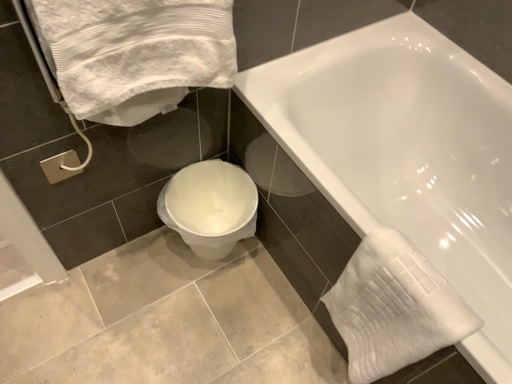
Image resolution: width=512 pixels, height=384 pixels. What do you see at coordinates (407, 154) in the screenshot?
I see `white glossy bathtub at center` at bounding box center [407, 154].

Image resolution: width=512 pixels, height=384 pixels. Find the location of `white textured towel at upper left, the 2th bath towel when ordered from bottom to top`. white textured towel at upper left, the 2th bath towel when ordered from bottom to top is located at coordinates click(x=136, y=53).

Image resolution: width=512 pixels, height=384 pixels. What do you see at coordinates (394, 307) in the screenshot?
I see `white textured towel at lower right, marked as the first bath towel in a right-to-left arrangement` at bounding box center [394, 307].

Locate an element on the screen. white textured towel at lower right, positioned as the 1th bath towel in bottom-to-top order is located at coordinates (394, 307).

Measure the distance between silver metallic towel bar at lower left and camera.

3.35 feet.

This screenshot has width=512, height=384. In order to click on white glossy bathtub at center in this screenshot , I will do `click(407, 154)`.

In the scene shown: Considering the positions of objects white textured towel at upper left, the second bath towel positioned from the right, and white plastic toilet at lower center in the image provided, who is more to the right, white textured towel at upper left, the second bath towel positioned from the right, or white plastic toilet at lower center?

From the viewer's perspective, white plastic toilet at lower center appears more on the right side.

From the image's perspective, is white textured towel at upper left, positioned as the 1th bath towel in left-to-right order, located above white plastic toilet at lower center?

Yes, from the image's perspective, white textured towel at upper left, positioned as the 1th bath towel in left-to-right order, is above white plastic toilet at lower center.

In the scene shown: Is white textured towel at upper left, positioned as the 1th bath towel in left-to-right order, oriented towards white plastic toilet at lower center?

No, white textured towel at upper left, positioned as the 1th bath towel in left-to-right order, is not aimed at white plastic toilet at lower center.

Considering the points (229, 86) and (186, 229), which point is in front, point (229, 86) or point (186, 229)?

Positioned in front is point (229, 86).

From the image's perspective, who appears lower, white plastic toilet at lower center or white glossy bathtub at center?

white plastic toilet at lower center.

Is white plastic toilet at lower center directly adjacent to white glossy bathtub at center?

No, white plastic toilet at lower center is not making contact with white glossy bathtub at center.

Considering the positions of objects white plastic toilet at lower center and white glossy bathtub at center in the image provided, who is behind, white plastic toilet at lower center or white glossy bathtub at center?

white plastic toilet at lower center is behind.

Considering the sizes of objects white textured towel at lower right, marked as the first bath towel in a right-to-left arrangement, and white glossy bathtub at center in the image provided, who is smaller, white textured towel at lower right, marked as the first bath towel in a right-to-left arrangement, or white glossy bathtub at center?

Smaller between the two is white textured towel at lower right, marked as the first bath towel in a right-to-left arrangement.

From a real-world perspective, is white textured towel at lower right, which is the 2th bath towel in top-to-bottom order, over white glossy bathtub at center?

Yes, from a real-world perspective, white textured towel at lower right, which is the 2th bath towel in top-to-bottom order, is above white glossy bathtub at center.

Considering the sizes of white textured towel at lower right, positioned as the 1th bath towel in bottom-to-top order, and white glossy bathtub at center in the image, is white textured towel at lower right, positioned as the 1th bath towel in bottom-to-top order, taller or shorter than white glossy bathtub at center?

white textured towel at lower right, positioned as the 1th bath towel in bottom-to-top order, is shorter than white glossy bathtub at center.

Based on the photo, from a real-world perspective, relative to white plastic toilet at lower center, is white glossy bathtub at center vertically above or below?

From a real-world perspective, white glossy bathtub at center is physically above white plastic toilet at lower center.

From the image's perspective, which one is positioned higher, white glossy bathtub at center or white plastic toilet at lower center?

white glossy bathtub at center is shown above in the image.

Is white glossy bathtub at center to the left of white plastic toilet at lower center from the viewer's perspective?

Incorrect, white glossy bathtub at center is not on the left side of white plastic toilet at lower center.

Which object is further away from the camera, white glossy bathtub at center or white plastic toilet at lower center?

white plastic toilet at lower center.

From a real-world perspective, which object stands above the other?

From a 3D spatial view, silver metallic towel bar at lower left is above.

Considering the positions of points (62, 166) and (461, 308), is point (62, 166) closer to camera compared to point (461, 308)?

No, it is not.

Find the location of a particular element. the 1st bath towel in front when counting from the silver metallic towel bar at lower left is located at coordinates (394, 307).

Looking at this image, from the image's perspective, is silver metallic towel bar at lower left under white textured towel at lower right, positioned as the 1th bath towel in bottom-to-top order?

No, from the image's perspective, silver metallic towel bar at lower left is not beneath white textured towel at lower right, positioned as the 1th bath towel in bottom-to-top order.

Is white glossy bathtub at center not within white textured towel at lower right, marked as the second bath towel in a left-to-right arrangement?

Absolutely, white glossy bathtub at center is external to white textured towel at lower right, marked as the second bath towel in a left-to-right arrangement.

Can you see white glossy bathtub at center touching white textured towel at lower right, marked as the second bath towel in a left-to-right arrangement?

No.

Is white glossy bathtub at center in front of white textured towel at lower right, marked as the second bath towel in a left-to-right arrangement?

That is True.

Is white textured towel at lower right, positioned as the 1th bath towel in bottom-to-top order, smaller than white plastic toilet at lower center?

Indeed, white textured towel at lower right, positioned as the 1th bath towel in bottom-to-top order, has a smaller size compared to white plastic toilet at lower center.

Considering the relative positions of white textured towel at lower right, marked as the second bath towel in a left-to-right arrangement, and white plastic toilet at lower center in the image provided, is white textured towel at lower right, marked as the second bath towel in a left-to-right arrangement, to the left of white plastic toilet at lower center from the viewer's perspective?

No.

Based on the photo, can you tell me how much white textured towel at lower right, positioned as the 1th bath towel in bottom-to-top order, and white plastic toilet at lower center differ in facing direction?

91 degrees.

From the image's perspective, which is below, white textured towel at lower right, marked as the second bath towel in a left-to-right arrangement, or white plastic toilet at lower center?

white textured towel at lower right, marked as the second bath towel in a left-to-right arrangement, from the image's perspective.

Where is `toilet on the right of white textured towel at upper left, the second bath towel positioned from the right`? The width and height of the screenshot is (512, 384). toilet on the right of white textured towel at upper left, the second bath towel positioned from the right is located at coordinates (210, 207).

This screenshot has height=384, width=512. I want to click on bathtub that appears in front of the white plastic toilet at lower center, so click(407, 154).

Which object lies nearer to the anchor point silver metallic towel bar at lower left, white textured towel at lower right, marked as the first bath towel in a right-to-left arrangement, or white textured towel at upper left, positioned as the 1th bath towel in left-to-right order?

Among the two, white textured towel at upper left, positioned as the 1th bath towel in left-to-right order, is located nearer to silver metallic towel bar at lower left.

Which object lies further to the anchor point white textured towel at lower right, marked as the first bath towel in a right-to-left arrangement, white textured towel at upper left, the second bath towel positioned from the right, or white glossy bathtub at center?

white textured towel at upper left, the second bath towel positioned from the right, lies further to white textured towel at lower right, marked as the first bath towel in a right-to-left arrangement, than the other object.

Looking at the image, which one is located further to white textured towel at upper left, the first bath towel when ordered from top to bottom, white textured towel at lower right, marked as the second bath towel in a left-to-right arrangement, or silver metallic towel bar at lower left?

white textured towel at lower right, marked as the second bath towel in a left-to-right arrangement, is positioned further to the anchor white textured towel at upper left, the first bath towel when ordered from top to bottom.

Estimate the real-world distances between objects in this image. Which object is further from white glossy bathtub at center, white plastic toilet at lower center or silver metallic towel bar at lower left?

The object further to white glossy bathtub at center is silver metallic towel bar at lower left.

Based on the photo, estimate the real-world distances between objects in this image. Which object is closer to white glossy bathtub at center, white textured towel at upper left, the second bath towel positioned from the right, or white plastic toilet at lower center?

white plastic toilet at lower center is closer to white glossy bathtub at center.

Which object lies further to the anchor point white plastic toilet at lower center, white textured towel at upper left, the second bath towel positioned from the right, or white textured towel at lower right, which is the 2th bath towel in top-to-bottom order?

Based on the image, white textured towel at upper left, the second bath towel positioned from the right, appears to be further to white plastic toilet at lower center.

Which object lies further to the anchor point white textured towel at lower right, which is the 2th bath towel in top-to-bottom order, white glossy bathtub at center or silver metallic towel bar at lower left?

The object further to white textured towel at lower right, which is the 2th bath towel in top-to-bottom order, is silver metallic towel bar at lower left.

Based on their spatial positions, is white textured towel at upper left, the first bath towel when ordered from top to bottom, or white textured towel at lower right, positioned as the 1th bath towel in bottom-to-top order, closer to white glossy bathtub at center?

The object closer to white glossy bathtub at center is white textured towel at lower right, positioned as the 1th bath towel in bottom-to-top order.

At what (x,y) coordinates should I click in order to perform the action: click on bath towel between white textured towel at upper left, the 2th bath towel when ordered from bottom to top, and white glossy bathtub at center. Please return your answer as a coordinate pair (x, y). This screenshot has height=384, width=512. Looking at the image, I should click on (394, 307).

At what (x,y) coordinates should I click in order to perform the action: click on bath towel between white textured towel at upper left, the first bath towel when ordered from top to bottom, and white plastic toilet at lower center, along the z-axis. Please return your answer as a coordinate pair (x, y). Looking at the image, I should click on (394, 307).

Find the location of a particular element. towel bar between white textured towel at upper left, the second bath towel positioned from the right, and white plastic toilet at lower center, along the z-axis is located at coordinates (61, 166).

Where is `toilet between silver metallic towel bar at lower left and white textured towel at lower right, marked as the first bath towel in a right-to-left arrangement, in the horizontal direction`? toilet between silver metallic towel bar at lower left and white textured towel at lower right, marked as the first bath towel in a right-to-left arrangement, in the horizontal direction is located at coordinates (210, 207).